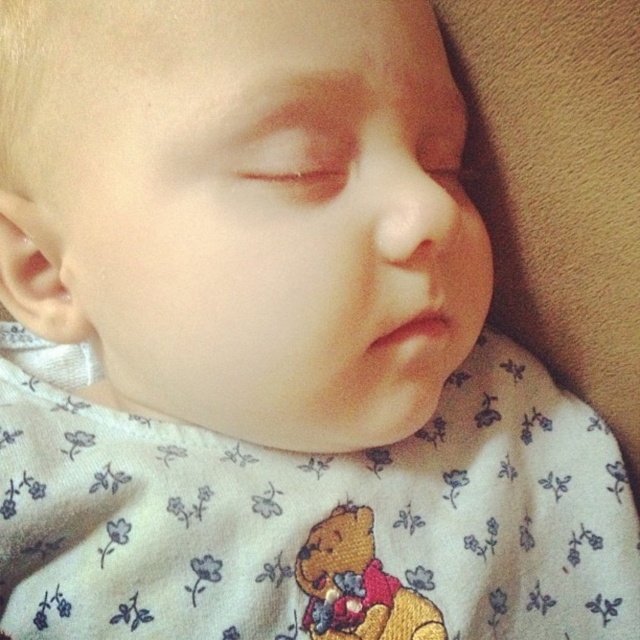
Which is in front, point (378, 220) or point (314, 618)?

Point (378, 220) is in front.

Is smooth skin baby at center bigger than embroidered plush bear at center?

Yes.

The width and height of the screenshot is (640, 640). Find the location of `smooth skin baby at center`. smooth skin baby at center is located at coordinates (243, 209).